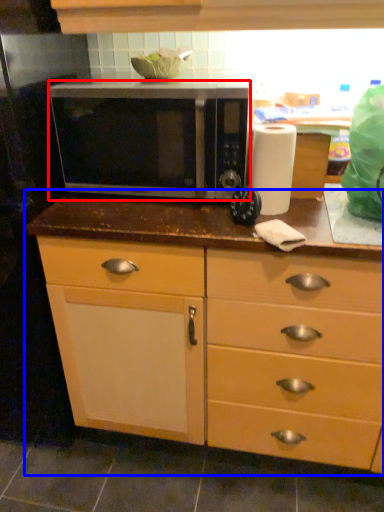
Question: Which of the following is the closest to the observer, microwave oven (highlighted by a red box) or cabinetry (highlighted by a blue box)?

Choices:
 (A) microwave oven
 (B) cabinetry

Answer: (B)